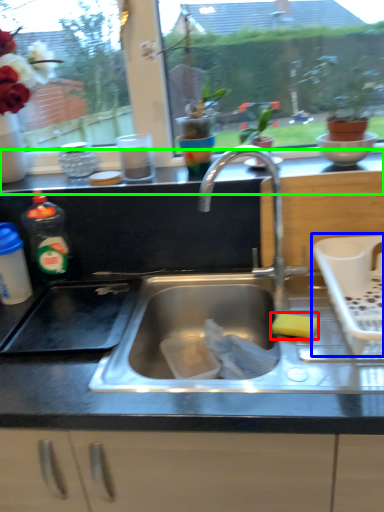
Question: Which object is positioned closest to food (highlighted by a red box)? Select from appliance (highlighted by a blue box) and counter top (highlighted by a green box).

Choices:
 (A) appliance
 (B) counter top

Answer: (A)